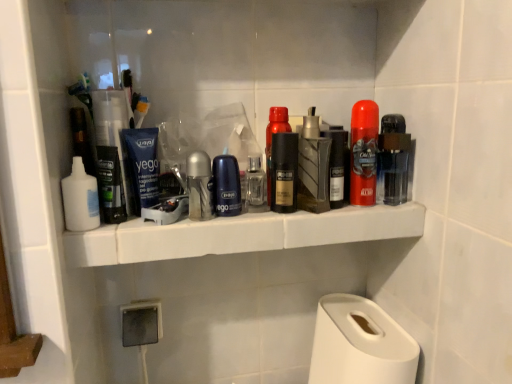
Question: Considering the relative sizes of metallic silver deodorant at center, the second toiletry when ordered from left to right, and white matte paper towel at lower right in the image provided, is metallic silver deodorant at center, the second toiletry when ordered from left to right, wider than white matte paper towel at lower right?

Choices:
 (A) yes
 (B) no

Answer: (B)

Question: Would you say white matte paper towel at lower right is part of metallic silver deodorant at center, arranged as the 3th toiletry when viewed from the right,'s contents?

Choices:
 (A) no
 (B) yes

Answer: (A)

Question: From a real-world perspective, is metallic silver deodorant at center, arranged as the 3th toiletry when viewed from the right, physically below white matte paper towel at lower right?

Choices:
 (A) yes
 (B) no

Answer: (B)

Question: Is metallic silver deodorant at center, the second toiletry when ordered from left to right, directly adjacent to white matte paper towel at lower right?

Choices:
 (A) yes
 (B) no

Answer: (B)

Question: Does metallic silver deodorant at center, the second toiletry when ordered from left to right, turn towards white matte paper towel at lower right?

Choices:
 (A) yes
 (B) no

Answer: (B)

Question: Is matte black deodorant at center, acting as the 5th personal care starting from the left, bigger or smaller than translucent plastic deodorant at center right, which is the first personal care from right to left?

Choices:
 (A) small
 (B) big

Answer: (A)

Question: Visually, is matte black deodorant at center, acting as the 5th personal care starting from the left, positioned to the left or to the right of translucent plastic deodorant at center right, which is the first personal care from right to left?

Choices:
 (A) left
 (B) right

Answer: (A)

Question: Looking at their shapes, would you say matte black deodorant at center, acting as the 5th personal care starting from the left, is wider or thinner than translucent plastic deodorant at center right, the eighth personal care in the left-to-right sequence?

Choices:
 (A) wide
 (B) thin

Answer: (B)

Question: Considering the positions of matte black deodorant at center, acting as the 5th personal care starting from the left, and translucent plastic deodorant at center right, which is the first personal care from right to left, in the image, is matte black deodorant at center, acting as the 5th personal care starting from the left, taller or shorter than translucent plastic deodorant at center right, which is the first personal care from right to left,?

Choices:
 (A) short
 (B) tall

Answer: (A)

Question: Is point (282, 208) closer or farther from the camera than point (310, 244)?

Choices:
 (A) closer
 (B) farther

Answer: (A)

Question: From a real-world perspective, is matte black deodorant at center, which ranks as the fourth personal care in right-to-left order, above or below white plastic shelf at center?

Choices:
 (A) above
 (B) below

Answer: (A)

Question: Is matte black deodorant at center, which ranks as the fourth personal care in right-to-left order, taller or shorter than white plastic shelf at center?

Choices:
 (A) short
 (B) tall

Answer: (B)

Question: Would you say matte black deodorant at center, acting as the 5th personal care starting from the left, is inside or outside white plastic shelf at center?

Choices:
 (A) inside
 (B) outside

Answer: (B)

Question: Based on their positions, is blue matte tube at center, which is counted as the 7th personal care, starting from the right, located to the left or right of clear glass spray bottle at center, acting as the 2th toiletry starting from the right?

Choices:
 (A) left
 (B) right

Answer: (A)

Question: In terms of height, does blue matte tube at center, which appears as the 2th personal care when viewed from the left, look taller or shorter compared to clear glass spray bottle at center, acting as the 2th toiletry starting from the right?

Choices:
 (A) short
 (B) tall

Answer: (B)